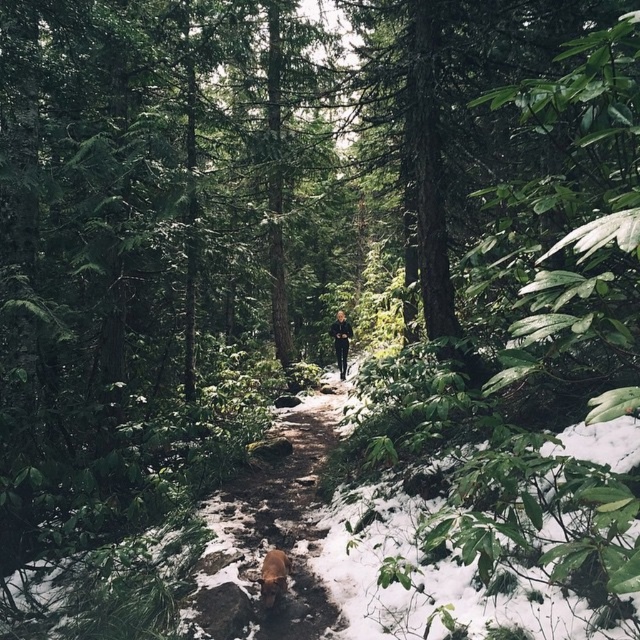
Question: Which point is farther to the camera?

Choices:
 (A) black matte pants at center
 (B) snowy dirt path at center
 (C) brown fur dog at center

Answer: (A)

Question: Can you confirm if brown fur dog at center is bigger than black matte pants at center?

Choices:
 (A) yes
 (B) no

Answer: (B)

Question: Can you confirm if brown fur dog at center is positioned to the right of black matte pants at center?

Choices:
 (A) no
 (B) yes

Answer: (A)

Question: Estimate the real-world distances between objects in this image. Which object is closer to the black matte pants at center?

Choices:
 (A) snowy dirt path at center
 (B) brown fur dog at center

Answer: (B)

Question: Which point is farther to the camera?

Choices:
 (A) snowy dirt path at center
 (B) brown fur dog at center

Answer: (B)

Question: Does brown fur dog at center have a larger size compared to black matte pants at center?

Choices:
 (A) yes
 (B) no

Answer: (B)